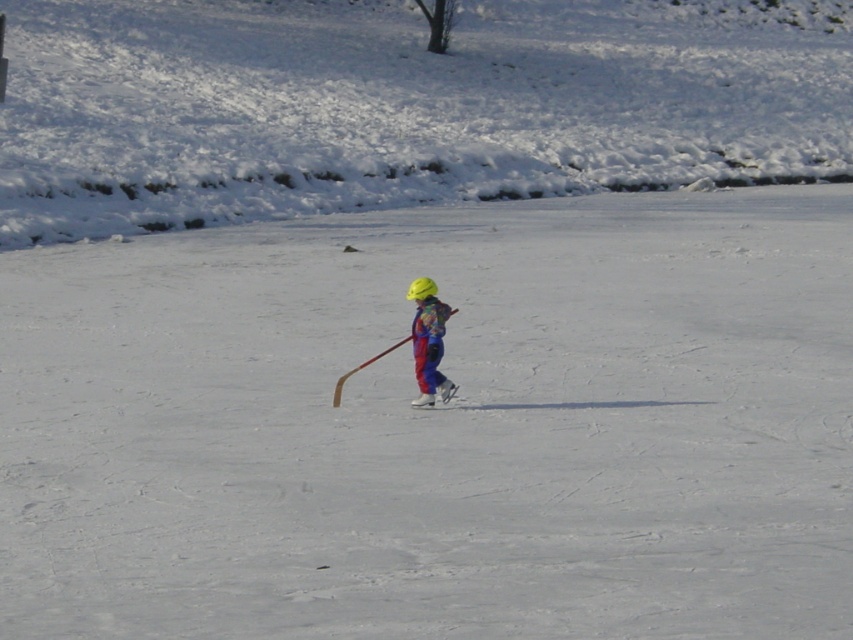
Is multicolored fabric child at center positioned at the back of white matte ski at center?

No, it is not.

From the picture: Is multicolored fabric child at center closer to camera compared to white matte ski at center?

Yes, multicolored fabric child at center is in front of white matte ski at center.

Who is more distant from viewer, [418,401] or [439,394]?

Point [439,394]

Where is `multicolored fabric child at center`? multicolored fabric child at center is located at coordinates (x=428, y=340).